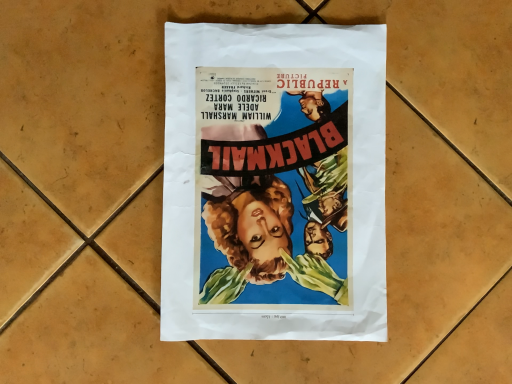
You are a GUI agent. You are given a task and a screenshot of the screen. Output one action in this format:
    pyautogui.click(x=<x>, y=<y>)
    Task: Click on the empty space that is ontop of vibrant paper poster at center (from a real-world perspective)
    
    Given the screenshot: What is the action you would take?
    pyautogui.click(x=278, y=178)